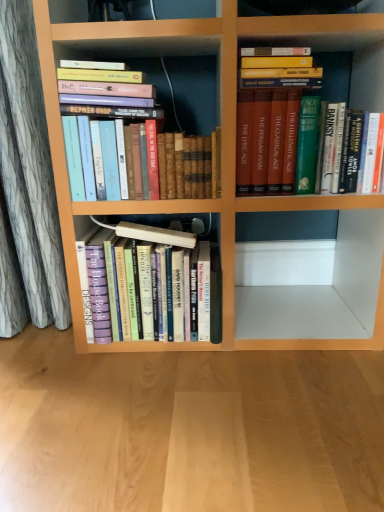
The image size is (384, 512). In order to click on vacant space situated on the left part of hardcover books at center, arranged as the second book when viewed from the left in this screenshot , I will do `click(43, 353)`.